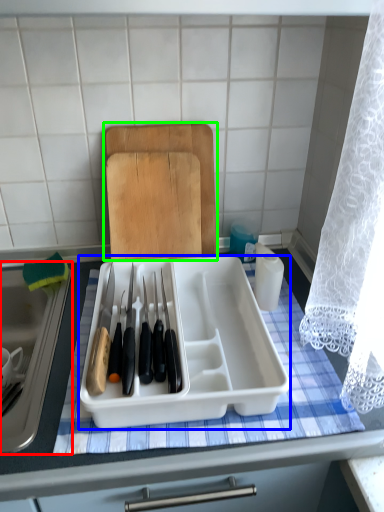
Question: Estimate the real-world distances between objects in this image. Which object is farther from sink (highlighted by a red box), kitchen appliance (highlighted by a blue box) or cutting board (highlighted by a green box)?

Choices:
 (A) kitchen appliance
 (B) cutting board

Answer: (B)